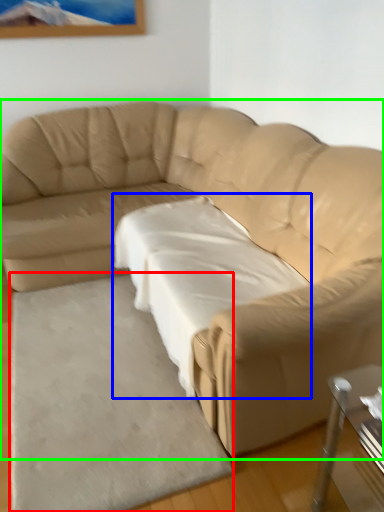
Question: Estimate the real-world distances between objects in this image. Which object is closer to mat (highlighted by a red box), sheet (highlighted by a blue box) or studio couch (highlighted by a green box)?

Choices:
 (A) sheet
 (B) studio couch

Answer: (A)